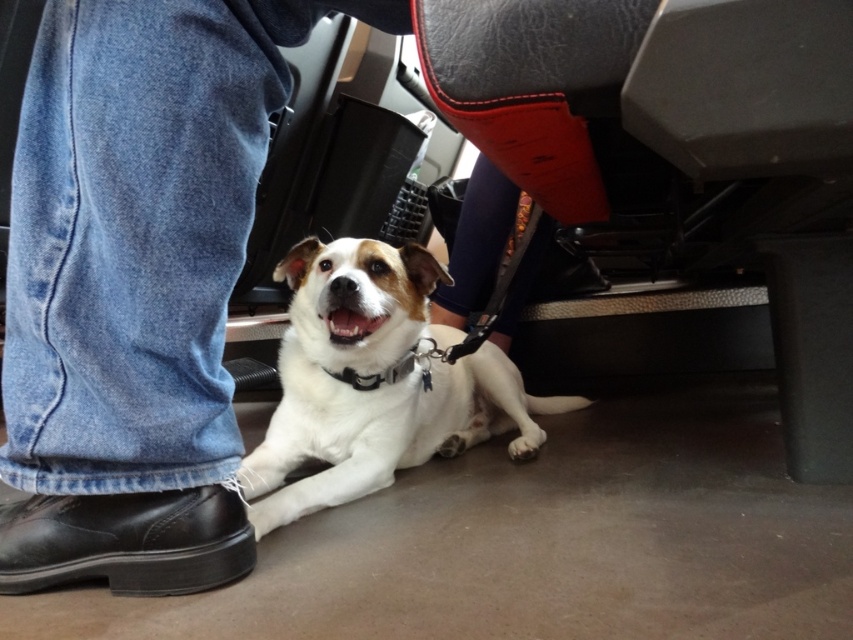
Question: Based on their relative distances, which object is nearer to the black leather shoe at lower left?

Choices:
 (A) jeans at lower left
 (B) white fur dog at center

Answer: (A)

Question: Can you confirm if jeans at lower left is positioned above white fur dog at center?

Choices:
 (A) no
 (B) yes

Answer: (B)

Question: Which point is farther from the camera taking this photo?

Choices:
 (A) (178, 544)
 (B) (281, 262)
 (C) (143, 156)

Answer: (B)

Question: Can you confirm if jeans at lower left is wider than black leather shoe at lower left?

Choices:
 (A) yes
 (B) no

Answer: (A)

Question: Which object is the closest to the jeans at lower left?

Choices:
 (A) white fur dog at center
 (B) black leather shoe at lower left

Answer: (B)

Question: Can you confirm if white fur dog at center is positioned above black leather shoe at lower left?

Choices:
 (A) yes
 (B) no

Answer: (A)